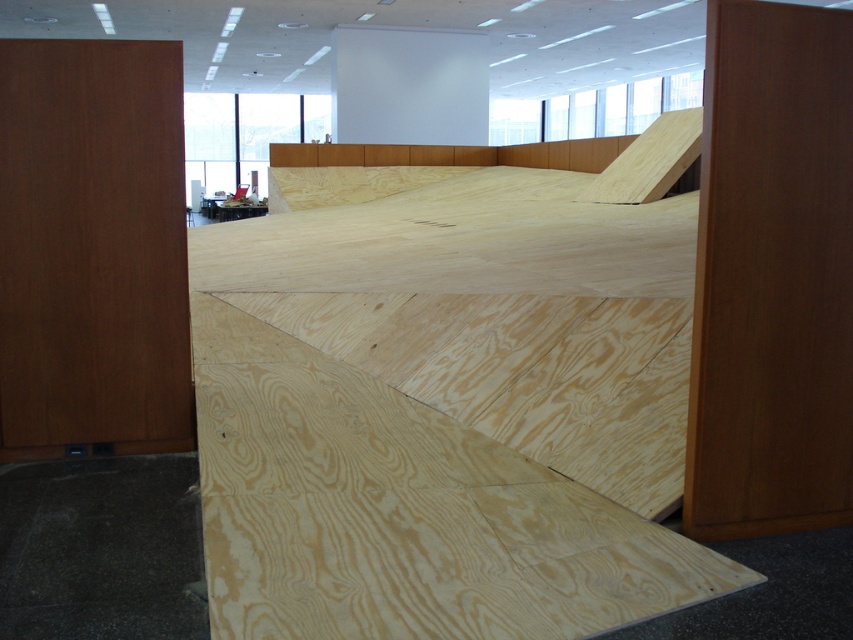
Is natural wood ramp at center below brown wood/plywood at left?

Incorrect, natural wood ramp at center is not positioned below brown wood/plywood at left.

This screenshot has height=640, width=853. Describe the element at coordinates (445, 408) in the screenshot. I see `natural wood ramp at center` at that location.

Identify the location of natural wood ramp at center. (445, 408).